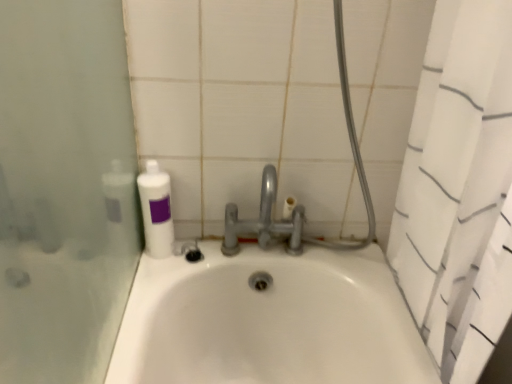
Question: Does white textured shower curtain at right have a greater height compared to satin nickel faucet at center?

Choices:
 (A) yes
 (B) no

Answer: (A)

Question: Considering the relative sizes of white textured shower curtain at right and satin nickel faucet at center in the image provided, is white textured shower curtain at right thinner than satin nickel faucet at center?

Choices:
 (A) no
 (B) yes

Answer: (A)

Question: From the image's perspective, is white textured shower curtain at right over satin nickel faucet at center?

Choices:
 (A) yes
 (B) no

Answer: (B)

Question: Can you confirm if white textured shower curtain at right is bigger than satin nickel faucet at center?

Choices:
 (A) yes
 (B) no

Answer: (A)

Question: Is white textured shower curtain at right with satin nickel faucet at center?

Choices:
 (A) yes
 (B) no

Answer: (B)

Question: Does white textured shower curtain at right have a lesser height compared to satin nickel faucet at center?

Choices:
 (A) yes
 (B) no

Answer: (B)

Question: Is white textured shower curtain at right directly adjacent to white matte bottle at upper left?

Choices:
 (A) yes
 (B) no

Answer: (B)

Question: Is white matte bottle at upper left at the back of white textured shower curtain at right?

Choices:
 (A) yes
 (B) no

Answer: (A)

Question: From the image's perspective, is white textured shower curtain at right located above white matte bottle at upper left?

Choices:
 (A) yes
 (B) no

Answer: (B)

Question: Is white textured shower curtain at right positioned behind white matte bottle at upper left?

Choices:
 (A) no
 (B) yes

Answer: (A)

Question: Is white matte bottle at upper left a part of white textured shower curtain at right?

Choices:
 (A) yes
 (B) no

Answer: (B)

Question: Can you confirm if white textured shower curtain at right is wider than white matte bottle at upper left?

Choices:
 (A) yes
 (B) no

Answer: (A)

Question: Is satin nickel faucet at center thinner than white matte bottle at upper left?

Choices:
 (A) no
 (B) yes

Answer: (A)